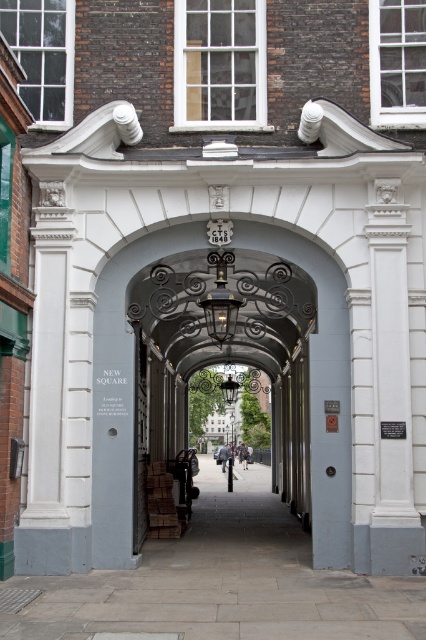
You are a painter standing in front of the entranceway and want to paint the smooth gray archway at center and the white stone pillar at left. Which object should you paint first if you want to start with the one closer to you?

The smooth gray archway at center is positioned on the right side of the white stone pillar at left, so the white stone pillar at left is closer to you. You should start painting the white stone pillar at left first.

You are standing at the entrance of the historic building and want to walk towards the smooth stone alley at center. Which direction should you walk?

You should walk forward towards the smooth stone alley at center located at the center of the image.

You are standing at point (121, 390) in the image. What object is directly in front of you?

The smooth gray archway at center is directly in front of you at point (121, 390).